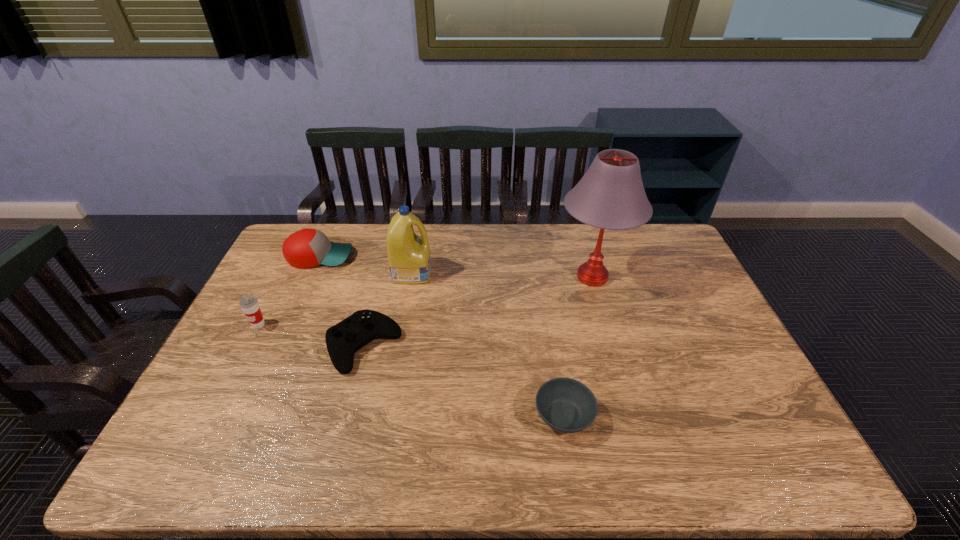
Locate an element on the screen. Image resolution: width=960 pixels, height=540 pixels. free location located 0.140m on the label of the fifth shortest object is located at coordinates coord(472,272).

Where is `vacant space positioned on the side of the third tallest object with the logo`? Image resolution: width=960 pixels, height=540 pixels. vacant space positioned on the side of the third tallest object with the logo is located at coordinates (220, 401).

Identify the location of vacant space located at the brim of the third shortest object. The image size is (960, 540). (381, 256).

This screenshot has width=960, height=540. I want to click on vacant region located on the right of the control, so click(x=457, y=346).

At what (x,y) coordinates should I click in order to perform the action: click on blank space located on the left of the soup bowl. Please return your answer as a coordinate pair (x, y). Image resolution: width=960 pixels, height=540 pixels. Looking at the image, I should click on (453, 416).

Image resolution: width=960 pixels, height=540 pixels. I want to click on table lamp that is at the far edge, so click(x=610, y=195).

Locate an element on the screen. This screenshot has width=960, height=540. detergent that is at the far edge is located at coordinates (409, 259).

Where is `baseball cap that is positioned at the far edge`? Image resolution: width=960 pixels, height=540 pixels. baseball cap that is positioned at the far edge is located at coordinates (308, 247).

Image resolution: width=960 pixels, height=540 pixels. In order to click on object at the near edge in this screenshot , I will do `click(566, 405)`.

Find the location of `cup situated at the left edge`. cup situated at the left edge is located at coordinates click(249, 304).